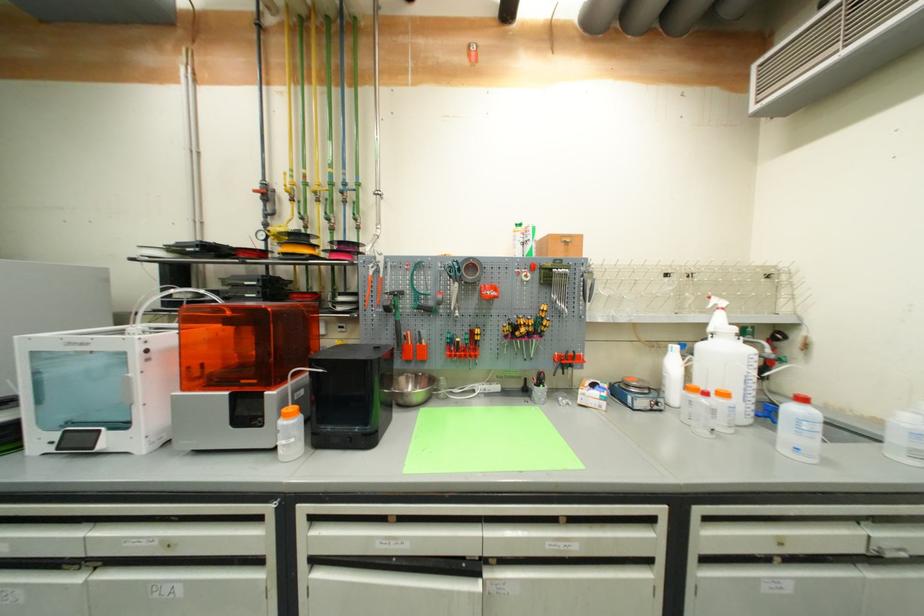
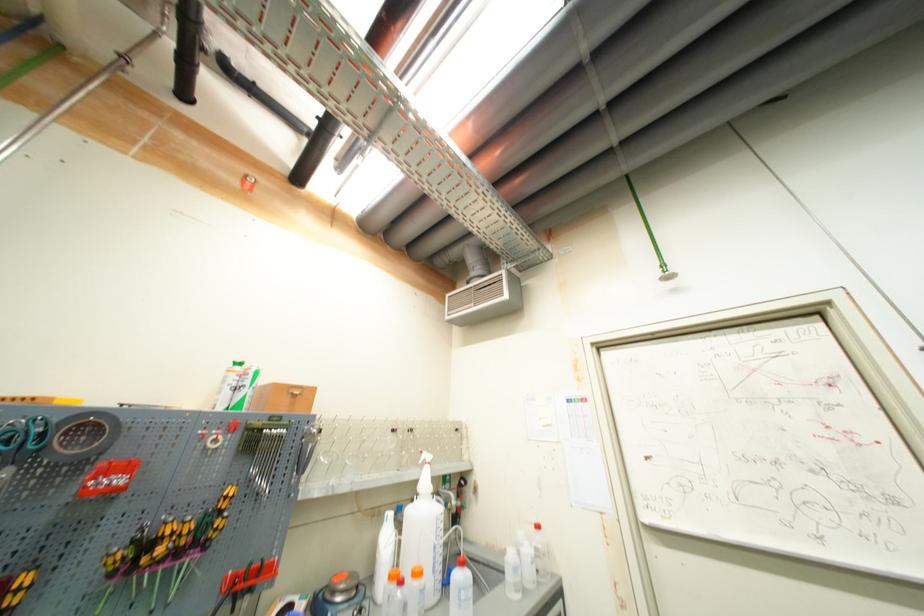
Find the pixel in the second image that matches the point at 479,55 in the first image.

(253, 185)